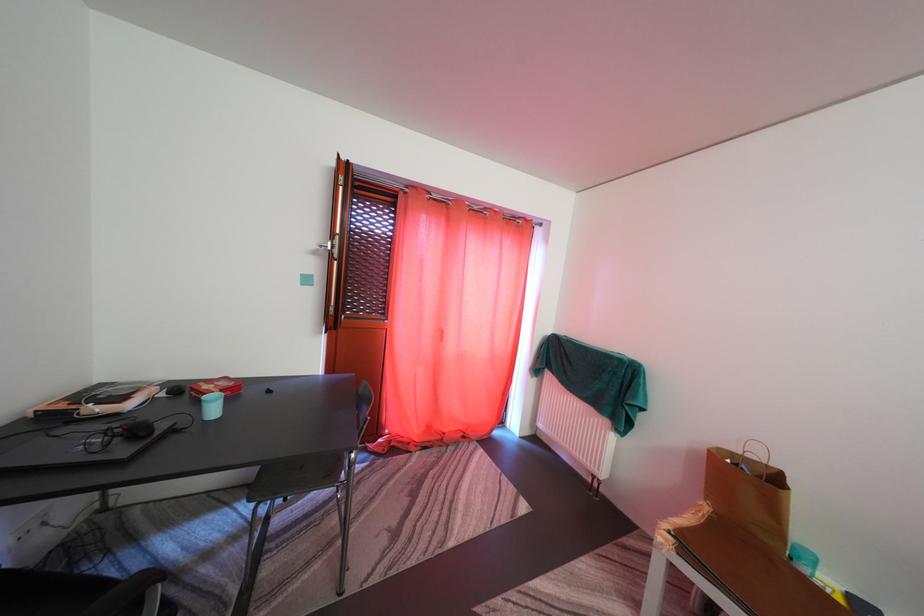
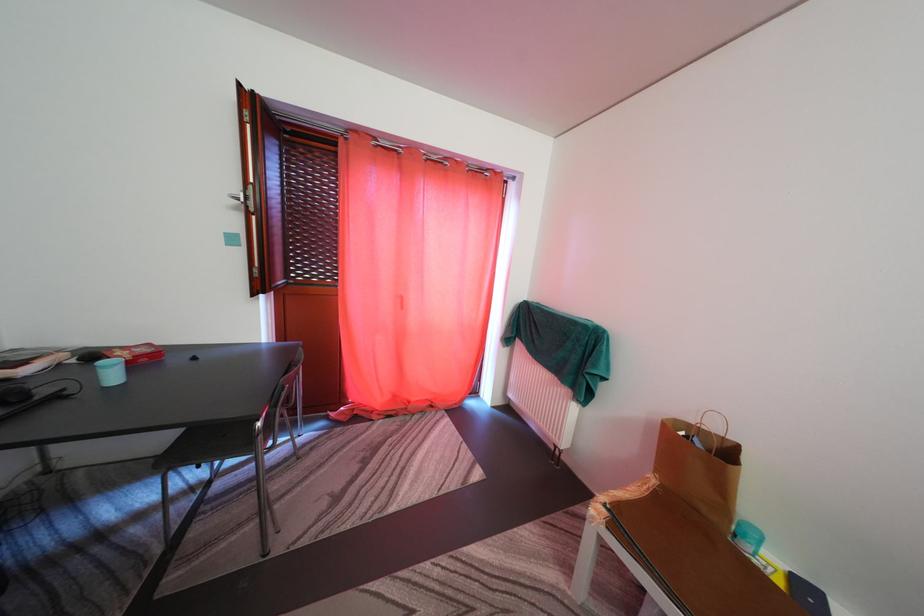
Where in the second image is the point corresponding to the point at 214,394 from the first image?

(128, 360)